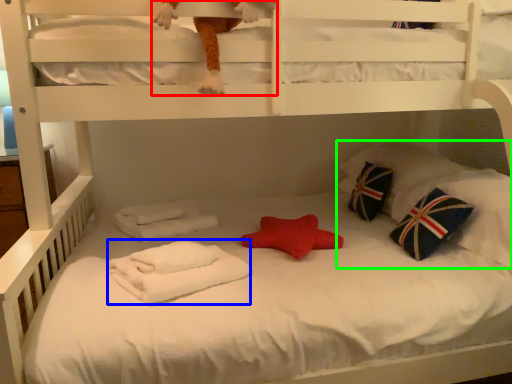
Question: Which object is the farthest from toy (highlighted by a red box)? Choose among these: material (highlighted by a blue box) or pillow (highlighted by a green box).

Choices:
 (A) material
 (B) pillow

Answer: (B)